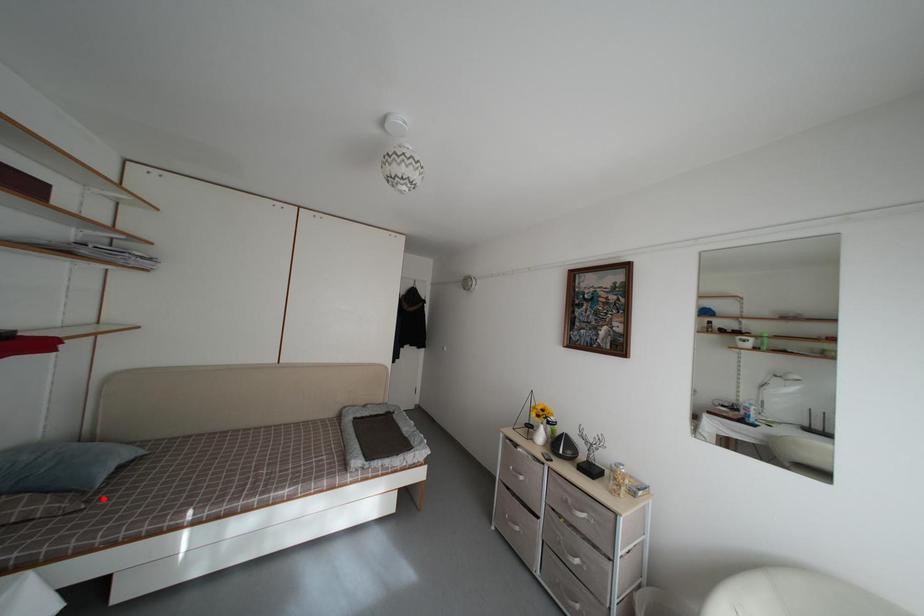
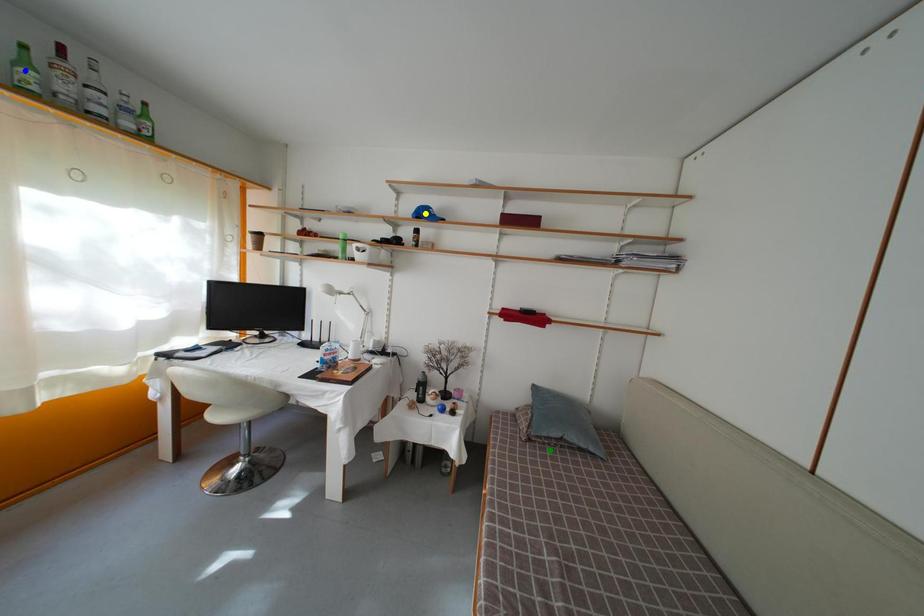
Question: I am providing you with two images of the same scene from different viewpoints. A red point is marked on the first image. You are given multiple points on the second image. In image 2, which mark is for the same physical point as the one in image 1?

Choices:
 (A) yellow point
 (B) green point
 (C) blue point

Answer: (B)